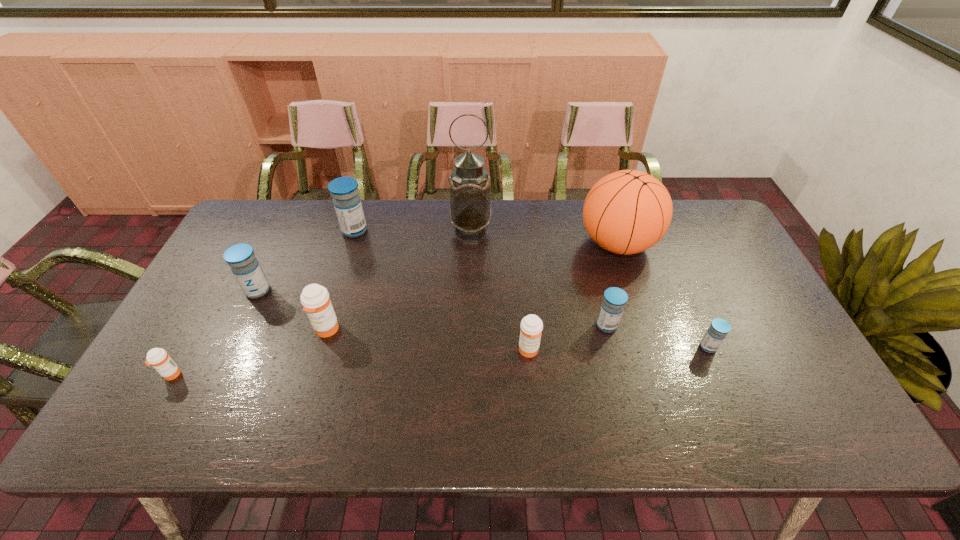
You are a GUI agent. You are given a task and a screenshot of the screen. Output one action in this format:
    pyautogui.click(x=<x>, y=<y>)
    Task: Click on the free space located on the right of the second orange medicine from left to right
    
    Given the screenshot: What is the action you would take?
    pyautogui.click(x=410, y=329)

The height and width of the screenshot is (540, 960). I want to click on free point located on the back of the second smallest blue medicine, so click(x=594, y=278).

At what (x,y) coordinates should I click in order to perform the action: click on free location located 0.210m on the back of the fourth object from right to left. Please return your answer as a coordinate pair (x, y). Looking at the image, I should click on (522, 282).

This screenshot has height=540, width=960. Identify the location of vacant space situated 0.120m on the back of the rightmost medicine. (690, 305).

The image size is (960, 540). Identify the location of blank area located on the right of the nearest medicine. (266, 375).

You are a GUI agent. You are given a task and a screenshot of the screen. Output one action in this format:
    pyautogui.click(x=<x>, y=<y>)
    Task: Click on the oil lamp at the far edge
    
    Given the screenshot: What is the action you would take?
    pyautogui.click(x=470, y=212)

The image size is (960, 540). What are the coordinates of `basketball positioned at the far edge` in the screenshot? It's located at (626, 212).

Locate an element on the screen. This screenshot has height=540, width=960. medicine situated at the far edge is located at coordinates (347, 202).

Locate an element on the screen. The width and height of the screenshot is (960, 540). vacant space at the far edge of the desktop is located at coordinates (411, 217).

This screenshot has width=960, height=540. Identify the location of free space at the near edge. click(716, 422).